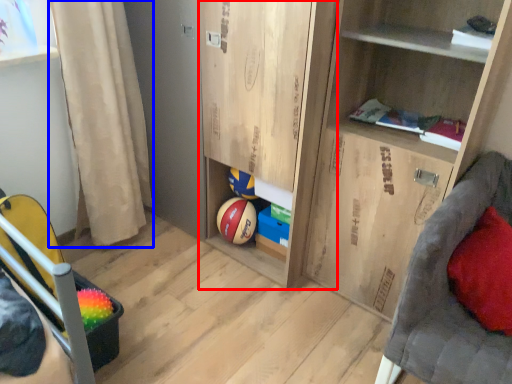
Question: Among these objects, which one is nearest to the camera, cabinet (highlighted by a red box) or curtain (highlighted by a blue box)?

Choices:
 (A) cabinet
 (B) curtain

Answer: (A)